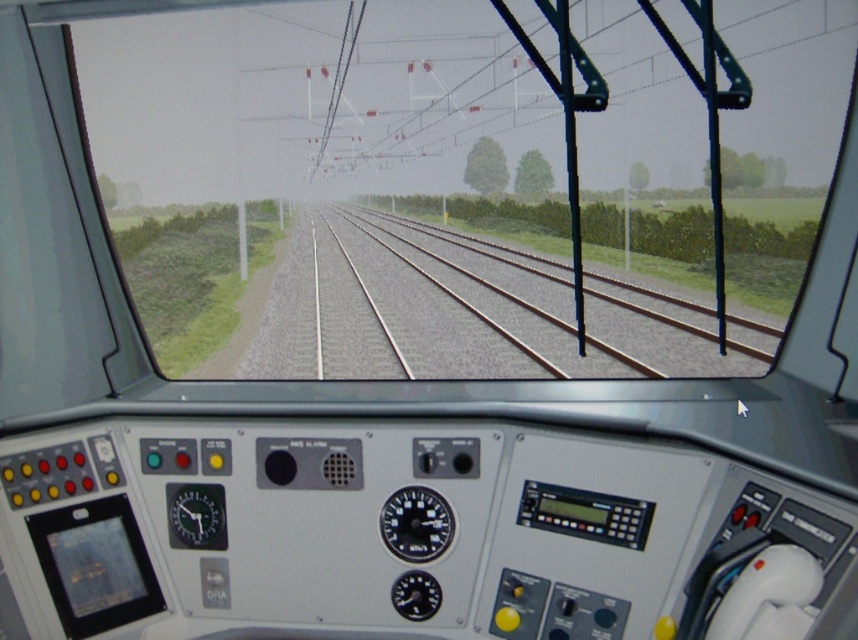
Question: Observing the image, what is the correct spatial positioning of brown metal track at center in reference to black plastic gauge at center?

Choices:
 (A) right
 (B) left

Answer: (A)

Question: Estimate the real-world distances between objects in this image. Which object is farther from the brown metal track at center?

Choices:
 (A) black plastic gauge at center
 (B) metallic gauge at center left

Answer: (B)

Question: Where is black plastic gauge at center located in relation to metallic gauge at center left in the image?

Choices:
 (A) below
 (B) above

Answer: (B)

Question: Is black plastic gauge at center to the left of metallic gauge at center left from the viewer's perspective?

Choices:
 (A) yes
 (B) no

Answer: (B)

Question: Which of these objects is positioned farthest from the metallic gauge at center left?

Choices:
 (A) brown metal track at center
 (B) black plastic gauge at center

Answer: (A)

Question: Which object is closer to the camera taking this photo?

Choices:
 (A) metallic gauge at center left
 (B) brown metal track at center
 (C) black plastic gauge at center

Answer: (C)